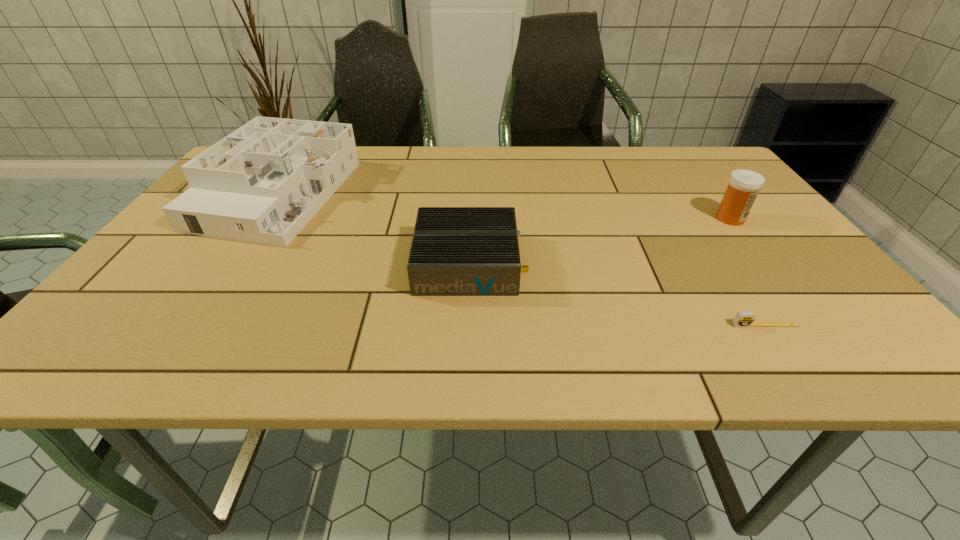
Locate an element on the screen. Image resolution: width=960 pixels, height=540 pixels. empty location between the shortest object and the medicine is located at coordinates (748, 272).

Where is `object that is the second closest one to the medicine`? This screenshot has height=540, width=960. object that is the second closest one to the medicine is located at coordinates (456, 251).

Locate which object is the closest to the third tallest object. Please provide its 2D coordinates. Your answer should be formatted as a tuple, i.e. [(x, y)], where the tuple contains the x and y coordinates of a point satisfying the conditions above.

[(263, 183)]